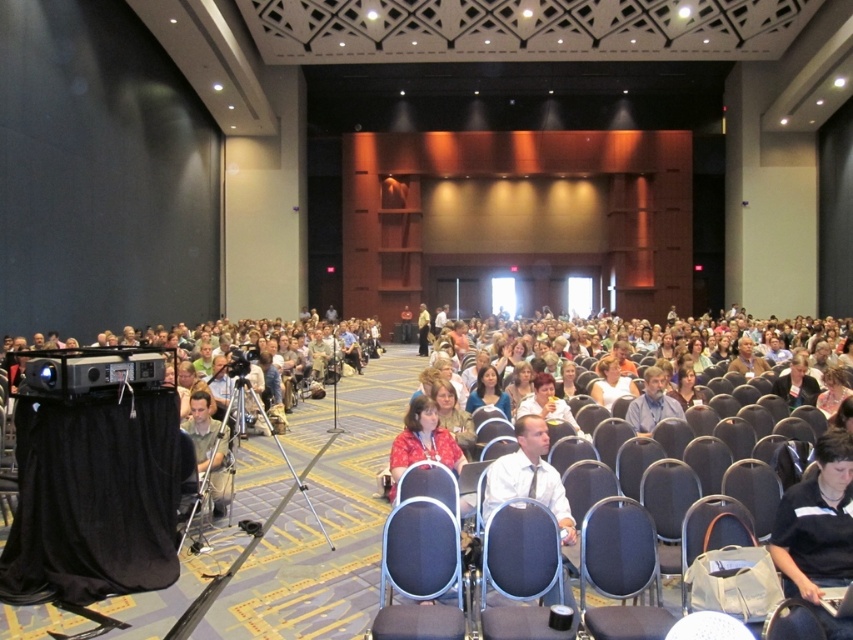
You are sitting in the gray fabric chair at lower right and want to see the light brown fabric shirt at lower left. Can you see it without moving your head?

The gray fabric chair at lower right is in front of the light brown fabric shirt at lower left, so you can see the light brown fabric shirt at lower left from your current position.

You are an event organizer who needs to place a 1.8 meter long banner between the matte blue chair at center and the matte black chair at lower right. Can the banner fit between them without overlapping the chairs?

The distance between the matte blue chair at center and the matte black chair at lower right is 1.79 meters. Since the banner is 1.8 meters long, it is slightly too long to fit between them without overlapping the chairs.